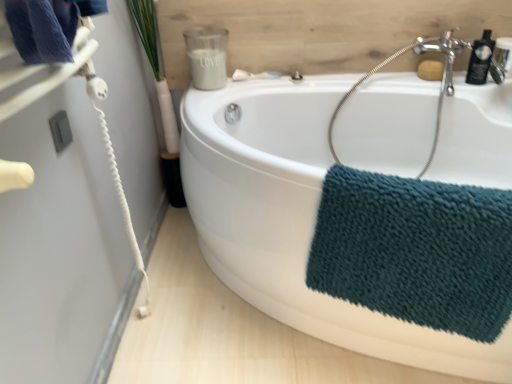
Question: Is satin nickel faucet at upper right outside of satin silver jar at upper center, marked as the 1th toiletry in a left-to-right arrangement?

Choices:
 (A) yes
 (B) no

Answer: (A)

Question: From the image's perspective, is satin nickel faucet at upper right on top of satin silver jar at upper center, marked as the 1th toiletry in a left-to-right arrangement?

Choices:
 (A) yes
 (B) no

Answer: (A)

Question: Can you confirm if satin nickel faucet at upper right is smaller than satin silver jar at upper center, positioned as the 2th toiletry in right-to-left order?

Choices:
 (A) no
 (B) yes

Answer: (B)

Question: Is satin nickel faucet at upper right to the left of satin silver jar at upper center, positioned as the 2th toiletry in right-to-left order, from the viewer's perspective?

Choices:
 (A) no
 (B) yes

Answer: (A)

Question: From a real-world perspective, does satin nickel faucet at upper right stand above satin silver jar at upper center, marked as the 1th toiletry in a left-to-right arrangement?

Choices:
 (A) yes
 (B) no

Answer: (B)

Question: Does satin nickel faucet at upper right have a larger size compared to satin silver jar at upper center, marked as the 1th toiletry in a left-to-right arrangement?

Choices:
 (A) yes
 (B) no

Answer: (B)

Question: Is teal textured towel at lower right completely or partially inside satin nickel faucet at upper right?

Choices:
 (A) no
 (B) yes

Answer: (A)

Question: Can you confirm if satin nickel faucet at upper right is taller than teal textured towel at lower right?

Choices:
 (A) yes
 (B) no

Answer: (B)

Question: Is satin nickel faucet at upper right next to teal textured towel at lower right?

Choices:
 (A) yes
 (B) no

Answer: (B)

Question: Considering the relative sizes of satin nickel faucet at upper right and teal textured towel at lower right in the image provided, is satin nickel faucet at upper right shorter than teal textured towel at lower right?

Choices:
 (A) no
 (B) yes

Answer: (B)

Question: Is satin nickel faucet at upper right positioned with its back to teal textured towel at lower right?

Choices:
 (A) yes
 (B) no

Answer: (B)

Question: Is satin nickel faucet at upper right thinner than teal textured towel at lower right?

Choices:
 (A) yes
 (B) no

Answer: (A)

Question: Does green leafy plant at upper left have a smaller size compared to white glossy bathtub at center?

Choices:
 (A) yes
 (B) no

Answer: (A)